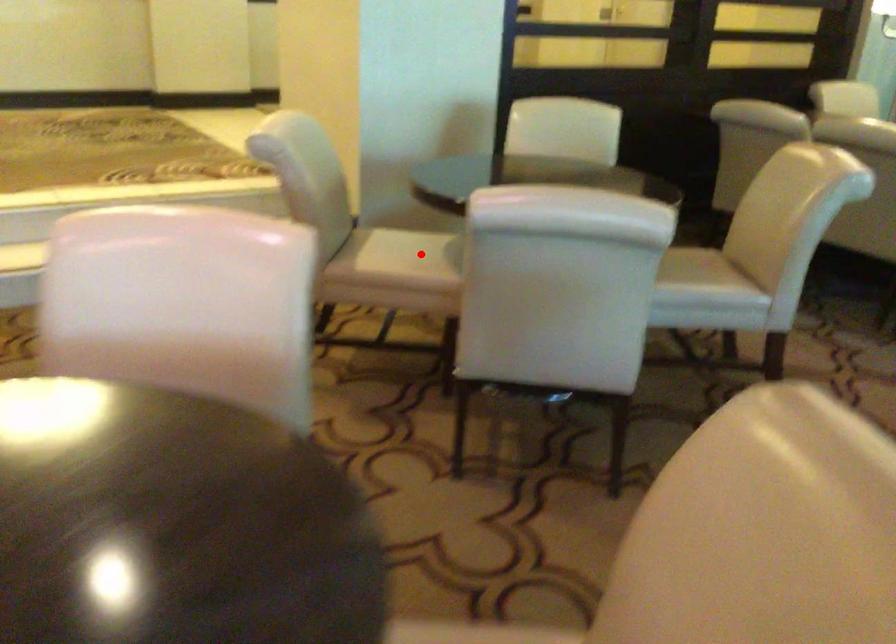
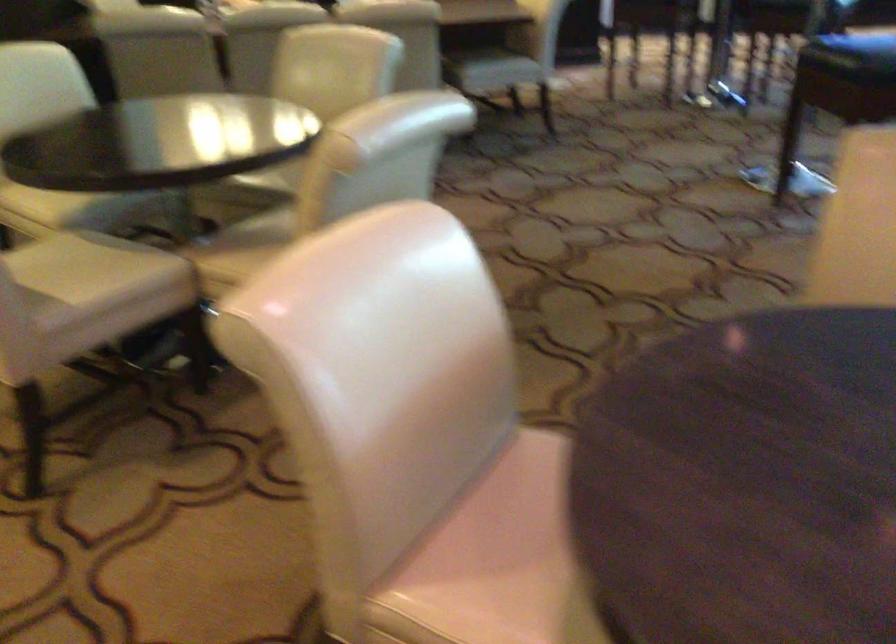
The point at the highlighted location is marked in the first image. Where is the corresponding point in the second image?

(82, 266)